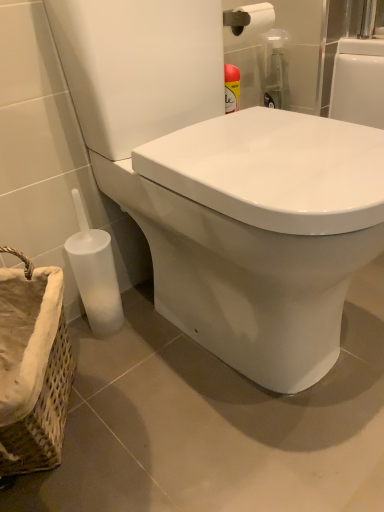
Question: Is white matte toilet brush at lower left inside woven fabric basket at lower left?

Choices:
 (A) yes
 (B) no

Answer: (B)

Question: Would you say woven fabric basket at lower left is a long distance from white matte toilet brush at lower left?

Choices:
 (A) yes
 (B) no

Answer: (B)

Question: Can you confirm if woven fabric basket at lower left is shorter than white matte toilet brush at lower left?

Choices:
 (A) no
 (B) yes

Answer: (B)

Question: Does woven fabric basket at lower left have a greater height compared to white matte toilet brush at lower left?

Choices:
 (A) no
 (B) yes

Answer: (A)

Question: Considering the relative sizes of woven fabric basket at lower left and white matte toilet brush at lower left in the image provided, is woven fabric basket at lower left smaller than white matte toilet brush at lower left?

Choices:
 (A) yes
 (B) no

Answer: (B)

Question: From their relative heights in the image, would you say woven fabric basket at lower left is taller or shorter than white matte toilet brush at lower left?

Choices:
 (A) tall
 (B) short

Answer: (B)

Question: Considering the positions of woven fabric basket at lower left and white matte toilet brush at lower left in the image, is woven fabric basket at lower left bigger or smaller than white matte toilet brush at lower left?

Choices:
 (A) big
 (B) small

Answer: (A)

Question: From the image's perspective, is woven fabric basket at lower left positioned above or below white matte toilet brush at lower left?

Choices:
 (A) above
 (B) below

Answer: (B)

Question: Considering the positions of point (28, 379) and point (109, 316), is point (28, 379) closer or farther from the camera than point (109, 316)?

Choices:
 (A) farther
 (B) closer

Answer: (B)

Question: In the image, is white glossy toilet at lower left positioned in front of or behind woven fabric basket at lower left?

Choices:
 (A) front
 (B) behind

Answer: (A)

Question: Looking at their shapes, would you say white glossy toilet at lower left is wider or thinner than woven fabric basket at lower left?

Choices:
 (A) thin
 (B) wide

Answer: (B)

Question: Based on their positions, is white glossy toilet at lower left located to the left or right of woven fabric basket at lower left?

Choices:
 (A) left
 (B) right

Answer: (B)

Question: From the image's perspective, is white glossy toilet at lower left above or below woven fabric basket at lower left?

Choices:
 (A) above
 (B) below

Answer: (A)

Question: Considering the positions of point (122, 324) and point (49, 454), is point (122, 324) closer or farther from the camera than point (49, 454)?

Choices:
 (A) farther
 (B) closer

Answer: (A)

Question: Considering the positions of white matte toilet brush at lower left and woven fabric basket at lower left in the image, is white matte toilet brush at lower left bigger or smaller than woven fabric basket at lower left?

Choices:
 (A) big
 (B) small

Answer: (B)